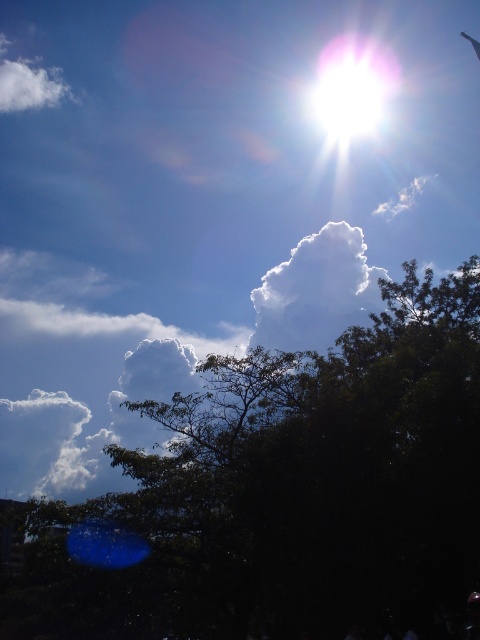
Can you confirm if white fluffy cloud at upper center is wider than white bright at upper center?

Indeed, white fluffy cloud at upper center has a greater width compared to white bright at upper center.

Between white fluffy cloud at upper center and white bright at upper center, which one is positioned lower?

white fluffy cloud at upper center is below.

Is point (374, 276) positioned behind point (334, 67)?

No, it is in front of (334, 67).

Identify the location of white fluffy cloud at upper center. (315, 291).

Which is above, green leafy tree at center or white fluffy cloud at upper center?

white fluffy cloud at upper center is above.

Who is more distant from viewer, (388, 305) or (314, 256)?

Point (314, 256)

Who is more distant from viewer, (335,410) or (347,273)?

The point (347,273) is more distant.

Locate an element on the screen. The image size is (480, 640). green leafy tree at center is located at coordinates (287, 493).

Is green leafy tree at center thinner than white bright at upper center?

No, green leafy tree at center is not thinner than white bright at upper center.

Is point (271, 449) positioned behind point (336, 56)?

No.

What are the coordinates of `green leafy tree at center` in the screenshot? It's located at (287, 493).